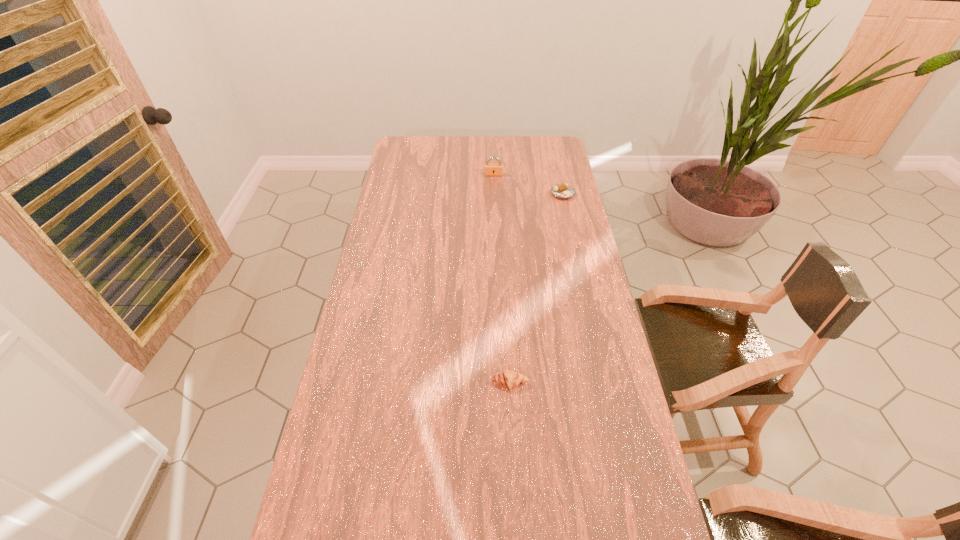
In the image, there is a desktop. Identify the location of blank space at the far edge. (475, 151).

At what (x,y) coordinates should I click in order to perform the action: click on vacant space at the left edge. Please return your answer as a coordinate pair (x, y). Looking at the image, I should click on [407, 249].

Image resolution: width=960 pixels, height=540 pixels. In order to click on free region at the right edge in this screenshot , I will do `click(555, 209)`.

The image size is (960, 540). What are the coordinates of `vacant space at the far right corner` in the screenshot? It's located at (546, 150).

I want to click on free space between the tallest object and the right pastry, so click(528, 184).

Where is `vacant area between the padlock and the second farthest object`? This screenshot has width=960, height=540. vacant area between the padlock and the second farthest object is located at coordinates (528, 184).

You are a GUI agent. You are given a task and a screenshot of the screen. Output one action in this format:
    pyautogui.click(x=<x>, y=<y>)
    Task: Click on the vacant point located between the nearer pastry and the farther pastry
    This screenshot has width=960, height=540.
    Given the screenshot: What is the action you would take?
    pyautogui.click(x=537, y=288)

You are a GUI agent. You are given a task and a screenshot of the screen. Output one action in this format:
    pyautogui.click(x=<x>, y=<y>)
    Task: Click on the vacant point located between the right pastry and the nearer pastry
    The width and height of the screenshot is (960, 540).
    Given the screenshot: What is the action you would take?
    pyautogui.click(x=537, y=288)

Identify the location of free space between the farthest object and the nearest object. The image size is (960, 540). (501, 279).

The width and height of the screenshot is (960, 540). Find the location of `object that is the nearest to the nearer pastry`. object that is the nearest to the nearer pastry is located at coordinates (563, 191).